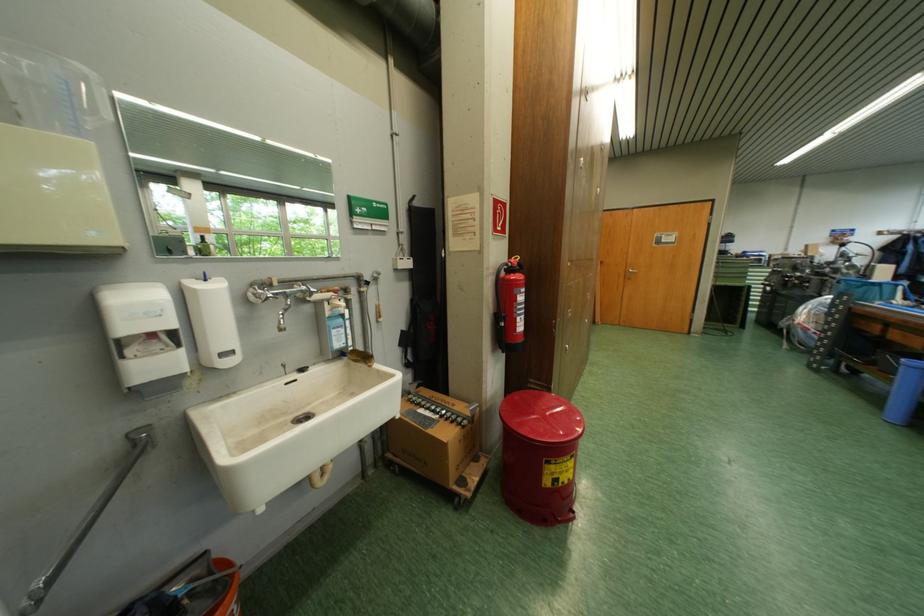
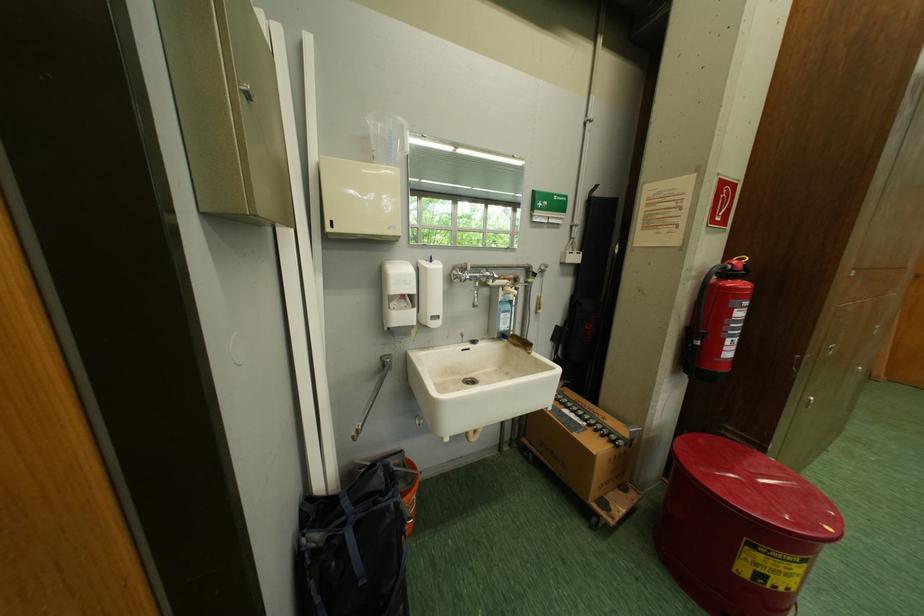
Question: I am providing you with two images of the same scene from different viewpoints. After the viewpoint changes to image2, which objects are now occluded?

Choices:
 (A) soap dispenser pump
 (B) red bin lid
 (C) plastic cup handle
 (D) none of these

Answer: (D)